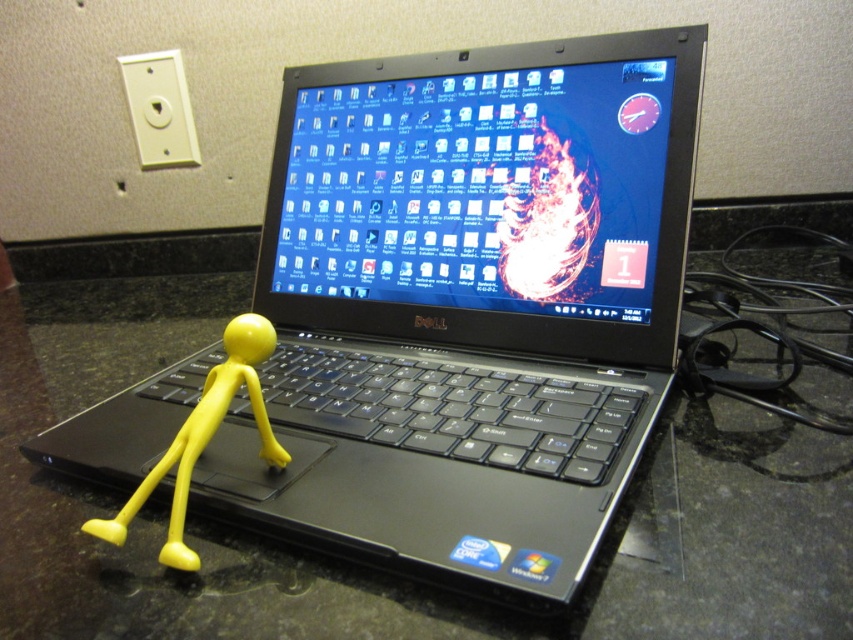
You are setting up a workspace and need to place both the black matte keyboard at center and the yellow matte stick figure at center on a desk. If the desk has a space that can only accommodate one of them, which object should you prioritize placing first based on their sizes?

The black matte keyboard at center is wider than the yellow matte stick figure at center, so you should prioritize placing the black matte keyboard at center first to ensure it fits in the available space.

You are a delivery robot that needs to place a small package on the black matte keyboard at center without knocking over the yellow matte stick figure at center. Can you fit the package on the keyboard?

The black matte keyboard at center is larger in size than yellow matte stick figure at center, so yes, the delivery robot can fit the package on the black matte keyboard at center without knocking over the yellow matte stick figure at center because there is enough space.

You are a delivery robot trying to place a package on the countertop. The package must be placed at point (489, 196). Is this point on the shiny plastic laptop at center or on the dark speckled countertop?

The point (489, 196) is on the shiny plastic laptop at center, so the package cannot be placed there as it is on the laptop itself.